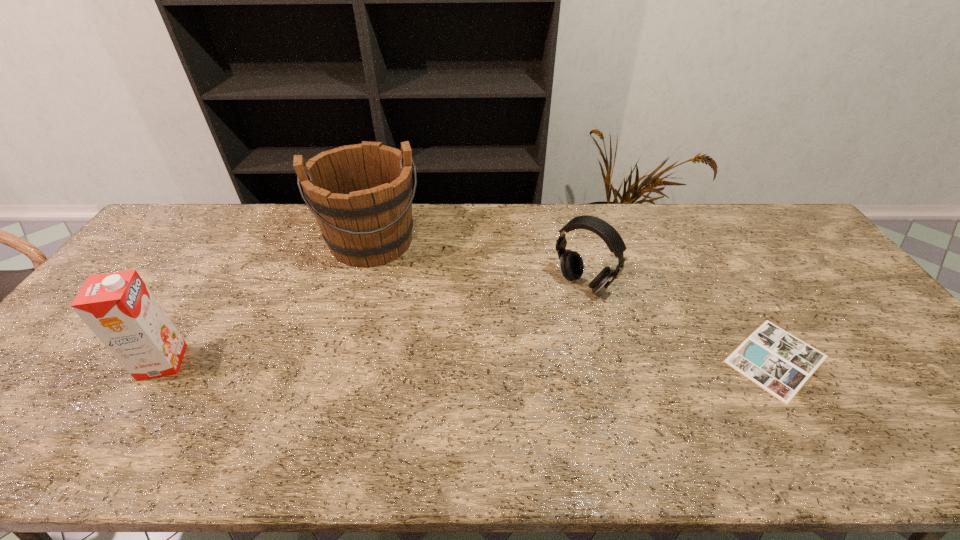
The image size is (960, 540). Identify the location of unoccupied position between the third object from left to right and the shortest object. (680, 321).

Identify which object is the second nearest to the carton. Please provide its 2D coordinates. Your answer should be formatted as a tuple, i.e. [(x, y)], where the tuple contains the x and y coordinates of a point satisfying the conditions above.

[(571, 263)]

I want to click on object that is the closest one to the earphone, so click(x=780, y=363).

Find the location of a particular element. The image size is (960, 540). free space in the image that satisfies the following two spatial constraints: 1. on the back side of the carton; 2. on the right side of the second object from left to right is located at coordinates (240, 241).

Where is `vacant position in the image that satisfies the following two spatial constraints: 1. on the back side of the wine bucket; 2. on the right side of the leftmost object`? The height and width of the screenshot is (540, 960). vacant position in the image that satisfies the following two spatial constraints: 1. on the back side of the wine bucket; 2. on the right side of the leftmost object is located at coordinates (240, 241).

You are a GUI agent. You are given a task and a screenshot of the screen. Output one action in this format:
    pyautogui.click(x=<x>, y=<y>)
    Task: Click on the vacant point that satisfies the following two spatial constraints: 1. on the back side of the rightmost object; 2. on the left side of the carton
    Image resolution: width=960 pixels, height=540 pixels.
    Given the screenshot: What is the action you would take?
    pyautogui.click(x=165, y=359)

Identify the location of vacant region that satisfies the following two spatial constraints: 1. on the back side of the leftmost object; 2. on the right side of the book. This screenshot has width=960, height=540. (165, 359).